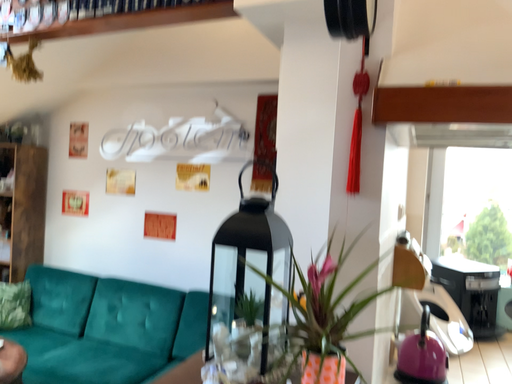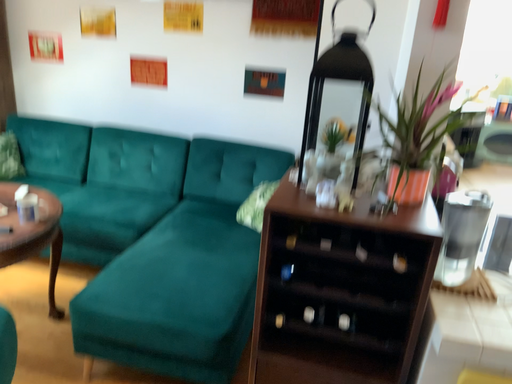
Question: How did the camera likely rotate when shooting the video?

Choices:
 (A) rotated upward
 (B) rotated downward

Answer: (B)